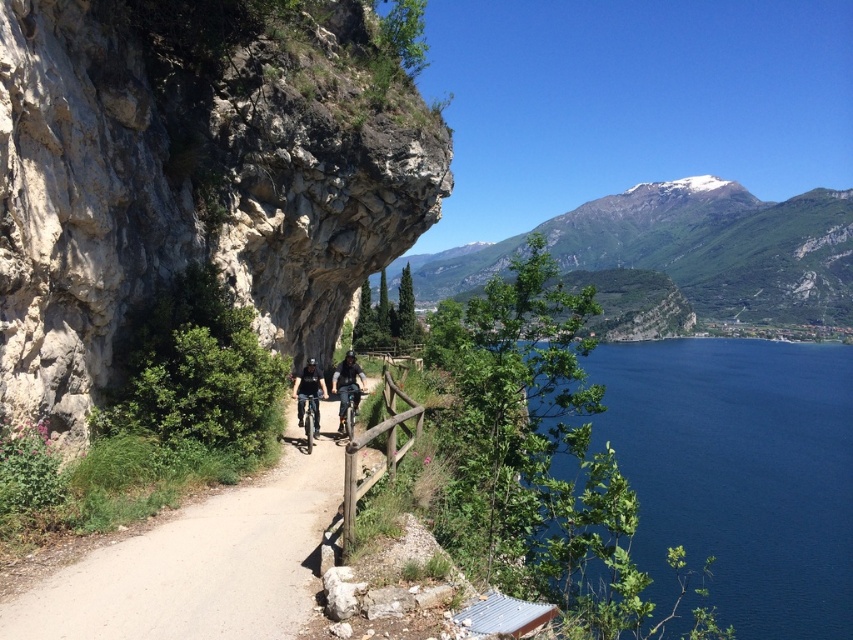
Question: Among these objects, which one is farthest from the camera?

Choices:
 (A) deep blue water at lower right
 (B) rugged stone cliff at left

Answer: (A)

Question: Is dirt path at center to the left of matte black bicycle at center from the viewer's perspective?

Choices:
 (A) no
 (B) yes

Answer: (A)

Question: Which is nearer to the deep blue water at lower right?

Choices:
 (A) dark blue fabric jacket at center
 (B) dirt path at center

Answer: (B)

Question: From the image, what is the correct spatial relationship of deep blue water at lower right in relation to green rocky mountain at upper right?

Choices:
 (A) above
 (B) below

Answer: (B)

Question: Among these points, which one is farthest from the camera?

Choices:
 (A) (679, 257)
 (B) (343, 404)
 (C) (767, 536)
 (D) (15, 634)

Answer: (A)

Question: Can you confirm if green rocky mountain at upper right is positioned to the left of matte black bicycle at center?

Choices:
 (A) no
 (B) yes

Answer: (A)